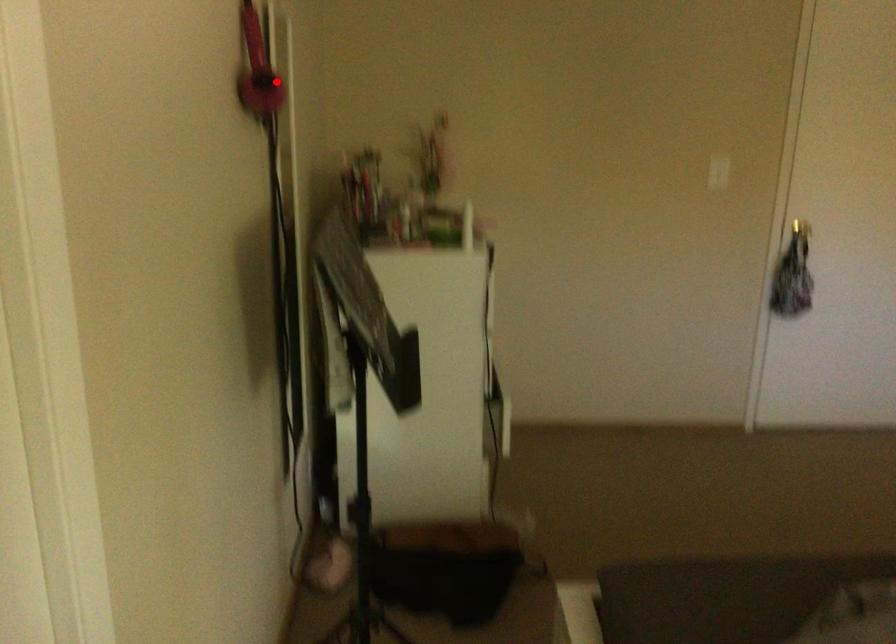
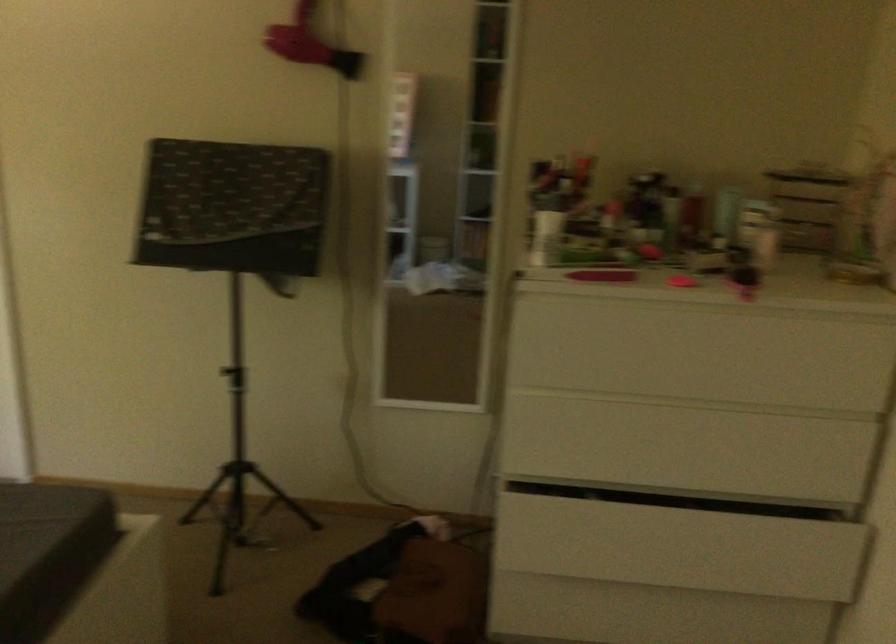
Locate, in the second image, the point that corresponds to the highlighted location in the first image.

(309, 44)